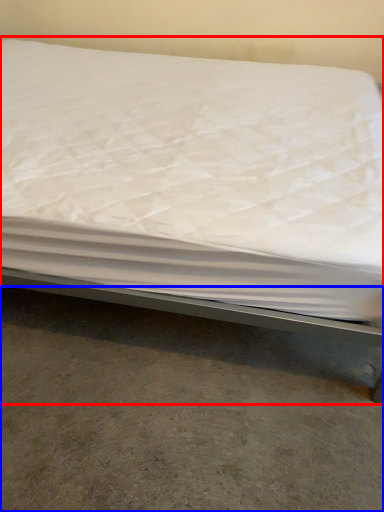
Question: Which of the following is the farthest to the observer, bed (highlighted by a red box) or concrete (highlighted by a blue box)?

Choices:
 (A) bed
 (B) concrete

Answer: (B)